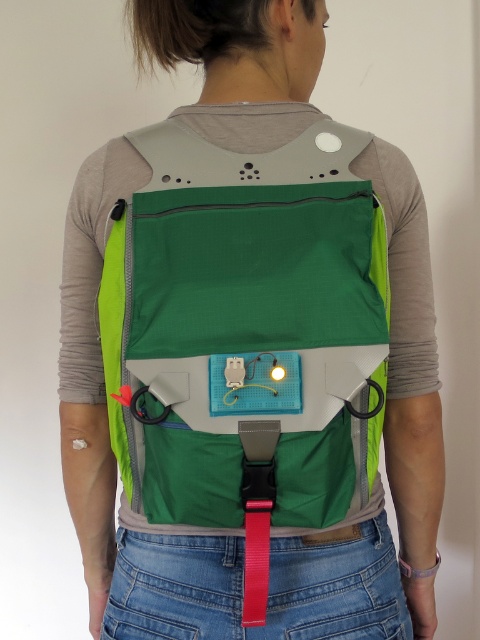
Which is in front, point (357, 385) or point (267, 506)?

Point (357, 385) is more forward.

From the picture: Which of these two, green fabric vest at center or red matte strap at center, stands shorter?

red matte strap at center

Does point (216, 476) lie behind point (252, 513)?

Yes, point (216, 476) is farther from viewer.

Find the location of a particular element. green fabric vest at center is located at coordinates (245, 326).